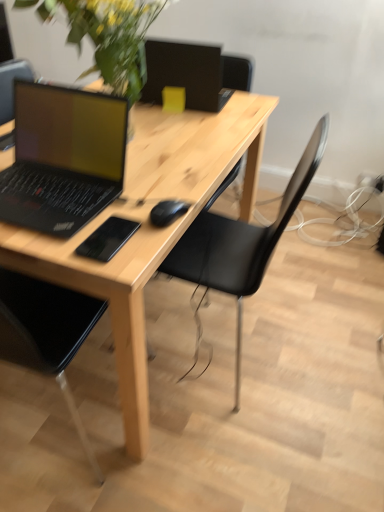
Question: Does green leafy plant at upper left have a larger size compared to black matte mousepad at center?

Choices:
 (A) yes
 (B) no

Answer: (A)

Question: Is green leafy plant at upper left behind black matte mousepad at center?

Choices:
 (A) yes
 (B) no

Answer: (A)

Question: Is green leafy plant at upper left oriented towards black matte mousepad at center?

Choices:
 (A) no
 (B) yes

Answer: (A)

Question: From a real-world perspective, is green leafy plant at upper left below black matte mousepad at center?

Choices:
 (A) yes
 (B) no

Answer: (B)

Question: Is green leafy plant at upper left outside of black matte mousepad at center?

Choices:
 (A) no
 (B) yes

Answer: (B)

Question: Does green leafy plant at upper left have a greater width compared to black matte mousepad at center?

Choices:
 (A) yes
 (B) no

Answer: (A)

Question: Does black matte mouse at center have a smaller size compared to matte black laptop at left?

Choices:
 (A) yes
 (B) no

Answer: (A)

Question: From the image's perspective, is black matte mouse at center over matte black laptop at left?

Choices:
 (A) yes
 (B) no

Answer: (B)

Question: Is black matte mouse at center positioned before matte black laptop at left?

Choices:
 (A) yes
 (B) no

Answer: (B)

Question: Is matte black laptop at left surrounded by black matte mouse at center?

Choices:
 (A) yes
 (B) no

Answer: (B)

Question: Can we say black matte mouse at center lies outside matte black laptop at left?

Choices:
 (A) no
 (B) yes

Answer: (B)

Question: From a real-world perspective, does black matte mouse at center sit lower than matte black laptop at left?

Choices:
 (A) yes
 (B) no

Answer: (A)

Question: Can you confirm if matte black laptop at left is positioned to the left of black matte mousepad at center?

Choices:
 (A) no
 (B) yes

Answer: (B)